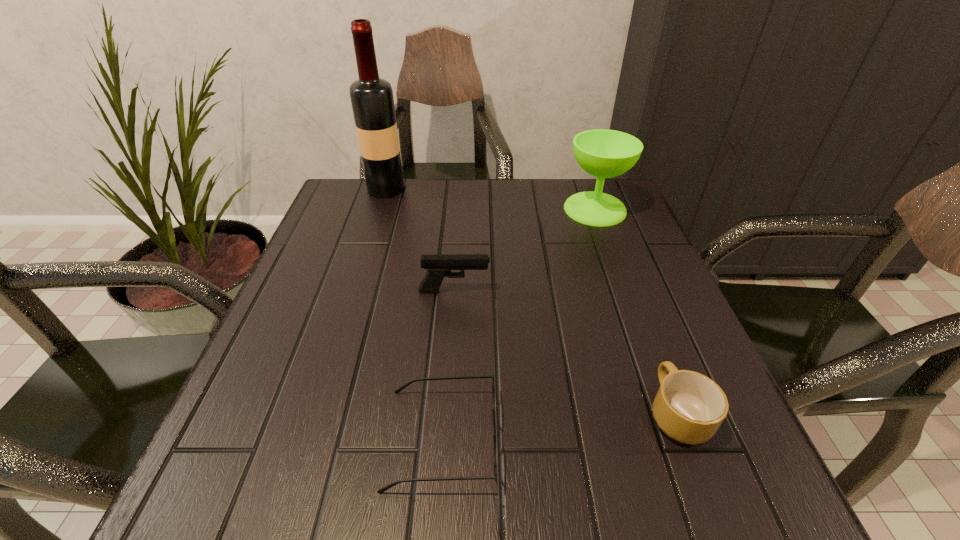
Locate an element on the screen. empty space between the shortest object and the second tallest object is located at coordinates (x=518, y=324).

I want to click on vacant space that is in between the second tallest object and the shortest object, so click(x=518, y=324).

This screenshot has width=960, height=540. Find the location of `free space between the second shortest object and the leftmost object`. free space between the second shortest object and the leftmost object is located at coordinates (531, 301).

Locate an element on the screen. The width and height of the screenshot is (960, 540). free spot between the tallest object and the pistol is located at coordinates (420, 240).

The height and width of the screenshot is (540, 960). Identify the location of vacant space that's between the mug and the leftmost object. (531, 301).

Where is `vacant point located between the shortest object and the leftmost object`? Image resolution: width=960 pixels, height=540 pixels. vacant point located between the shortest object and the leftmost object is located at coordinates (414, 314).

Where is `empty space between the fourth shortest object and the pistol`? empty space between the fourth shortest object and the pistol is located at coordinates (524, 250).

At what (x,y) coordinates should I click in order to perform the action: click on free space between the wineglass and the shortest object. Please return your answer as a coordinate pair (x, y). The height and width of the screenshot is (540, 960). Looking at the image, I should click on (518, 324).

At what (x,y) coordinates should I click in order to perform the action: click on object that is the fourth nearest to the third tallest object. Please return your answer as a coordinate pair (x, y). Looking at the image, I should click on (372, 101).

Locate which object is the closest to the second tallest object. Please provide its 2D coordinates. Your answer should be formatted as a tuple, i.e. [(x, y)], where the tuple contains the x and y coordinates of a point satisfying the conditions above.

[(438, 266)]